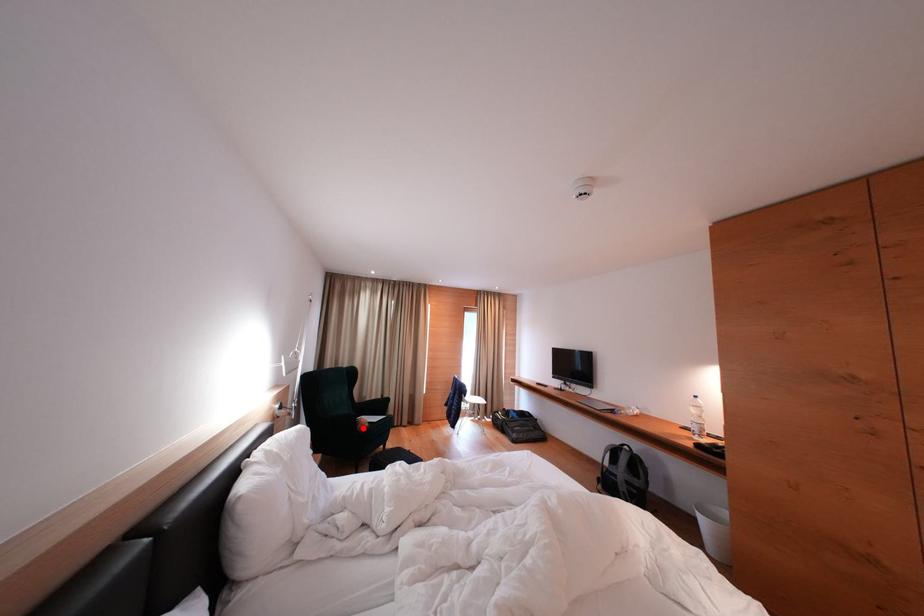
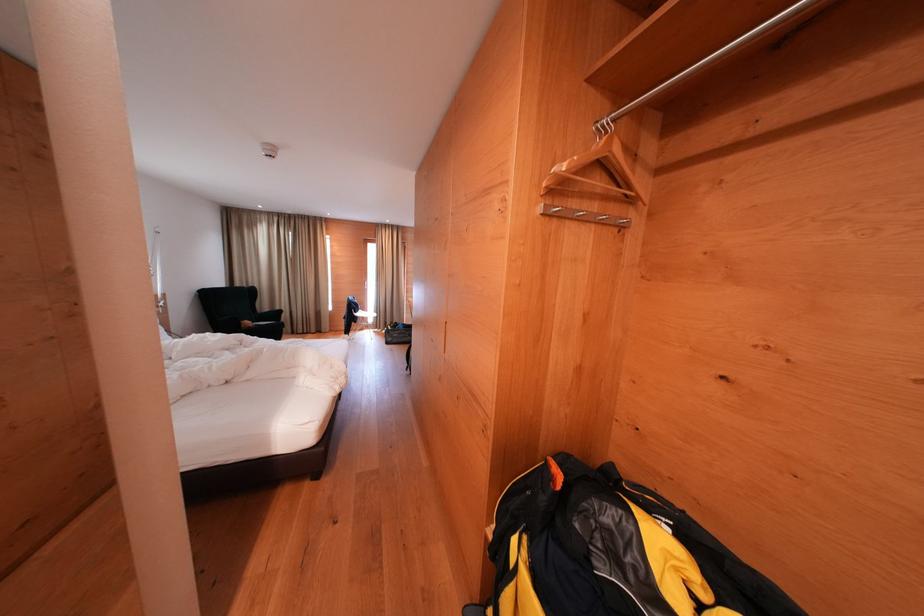
Locate, in the second image, the point that corresponds to the highlighted location in the first image.

(247, 329)